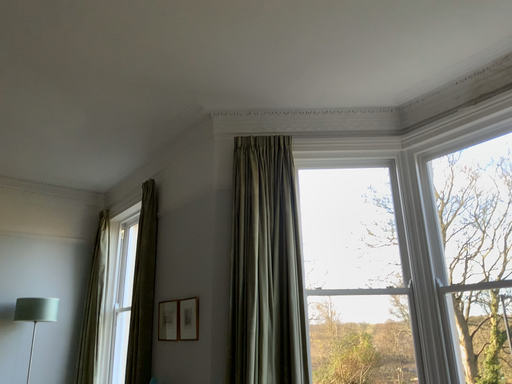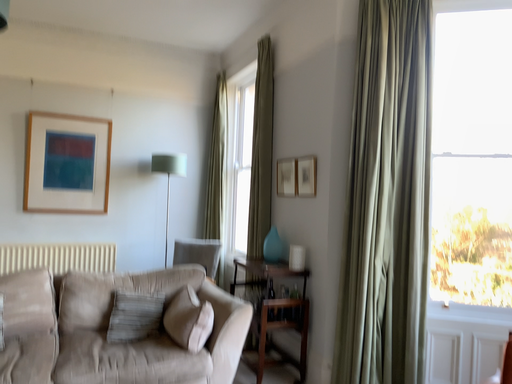
Question: How did the camera likely rotate when shooting the video?

Choices:
 (A) rotated right
 (B) rotated left

Answer: (B)